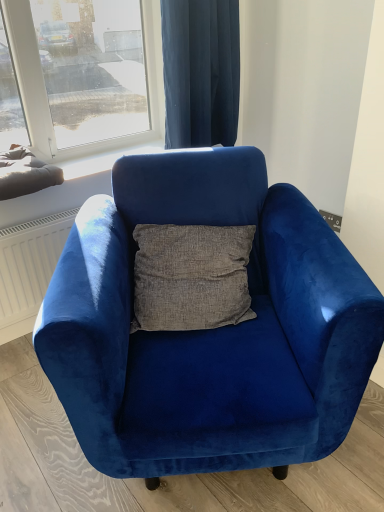
Question: From the image's perspective, would you say velvet blue curtain at upper center is shown under velvet blue armchair at center?

Choices:
 (A) yes
 (B) no

Answer: (B)

Question: Considering the relative sizes of velvet blue curtain at upper center and velvet blue armchair at center in the image provided, is velvet blue curtain at upper center thinner than velvet blue armchair at center?

Choices:
 (A) no
 (B) yes

Answer: (B)

Question: Does velvet blue curtain at upper center have a larger size compared to velvet blue armchair at center?

Choices:
 (A) no
 (B) yes

Answer: (A)

Question: Is velvet blue curtain at upper center to the left of velvet blue armchair at center from the viewer's perspective?

Choices:
 (A) no
 (B) yes

Answer: (A)

Question: From the image's perspective, would you say velvet blue curtain at upper center is positioned over velvet blue armchair at center?

Choices:
 (A) no
 (B) yes

Answer: (B)

Question: Is velvet blue curtain at upper center looking in the opposite direction of velvet blue armchair at center?

Choices:
 (A) no
 (B) yes

Answer: (A)

Question: Is velvet blue armchair at center not close to velvet blue curtain at upper center?

Choices:
 (A) no
 (B) yes

Answer: (A)

Question: From the image's perspective, is velvet blue armchair at center over velvet blue curtain at upper center?

Choices:
 (A) no
 (B) yes

Answer: (A)

Question: Can we say velvet blue armchair at center lies outside velvet blue curtain at upper center?

Choices:
 (A) yes
 (B) no

Answer: (A)

Question: Is the depth of velvet blue armchair at center less than that of velvet blue curtain at upper center?

Choices:
 (A) yes
 (B) no

Answer: (A)

Question: Does velvet blue armchair at center appear on the left side of velvet blue curtain at upper center?

Choices:
 (A) no
 (B) yes

Answer: (B)

Question: Is velvet blue armchair at center taller than velvet blue curtain at upper center?

Choices:
 (A) no
 (B) yes

Answer: (B)

Question: Is velvet blue armchair at center inside the boundaries of velvet blue curtain at upper center, or outside?

Choices:
 (A) inside
 (B) outside

Answer: (B)